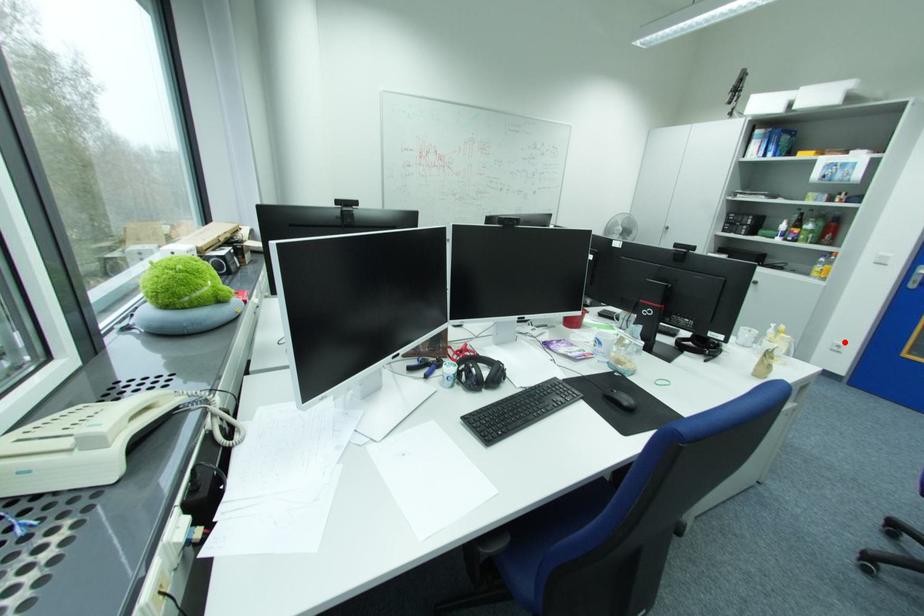
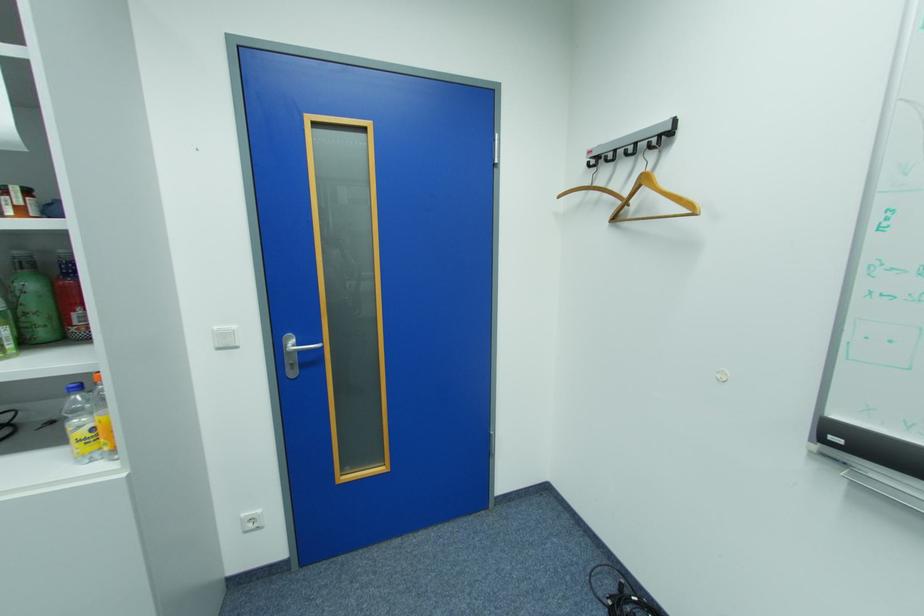
The point at the highlighted location is marked in the first image. Where is the corresponding point in the second image?

(252, 516)